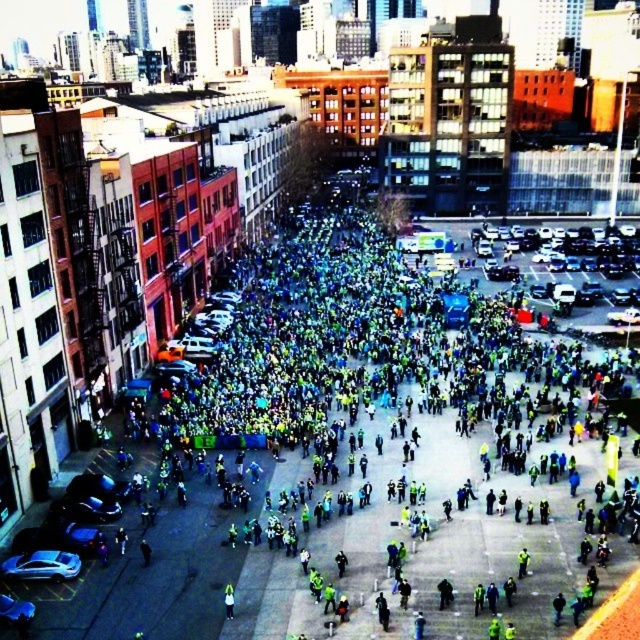
Question: Which object appears closest to the camera in this image?

Choices:
 (A) green reflective jacket at center
 (B) green matte jacket at center

Answer: (A)

Question: Does green reflective jacket at center appear on the right side of green matte jacket at center?

Choices:
 (A) yes
 (B) no

Answer: (A)

Question: Is green reflective jacket at center to the left of green matte jacket at center from the viewer's perspective?

Choices:
 (A) yes
 (B) no

Answer: (B)

Question: Which point is closer to the camera?

Choices:
 (A) (364, 237)
 (B) (227, 595)

Answer: (B)

Question: Is the position of green reflective jacket at center more distant than that of green matte jacket at center?

Choices:
 (A) no
 (B) yes

Answer: (A)